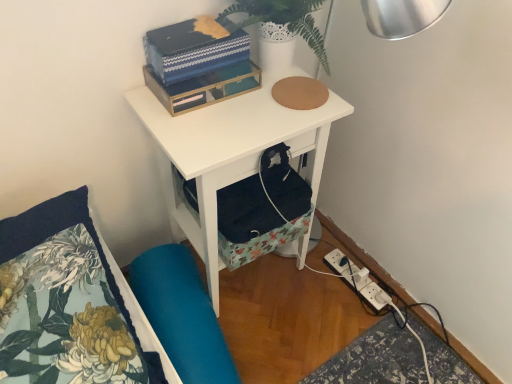
You are a GUI agent. You are given a task and a screenshot of the screen. Output one action in this format:
    pyautogui.click(x=<x>, y=<y>)
    Task: Click on the vacant area located to the right-hand side of teal fabric swivel chair at lower left
    The height and width of the screenshot is (384, 512).
    Given the screenshot: What is the action you would take?
    [284, 328]